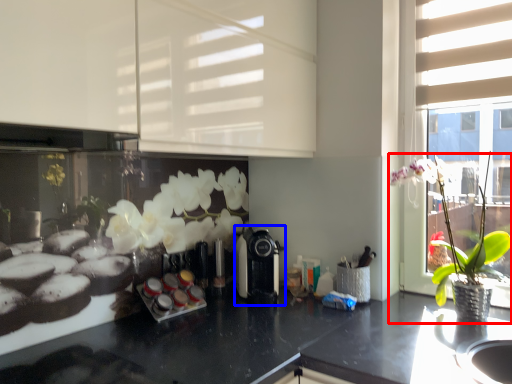
Question: Which of the following is the farthest to the observer, houseplant (highlighted by a red box) or coffee machine (highlighted by a blue box)?

Choices:
 (A) houseplant
 (B) coffee machine

Answer: (B)